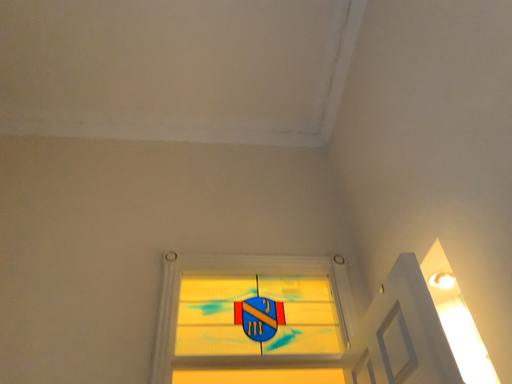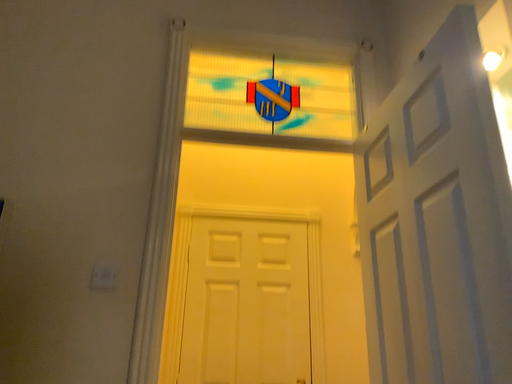
Question: How did the camera likely rotate when shooting the video?

Choices:
 (A) rotated downward
 (B) rotated upward

Answer: (A)